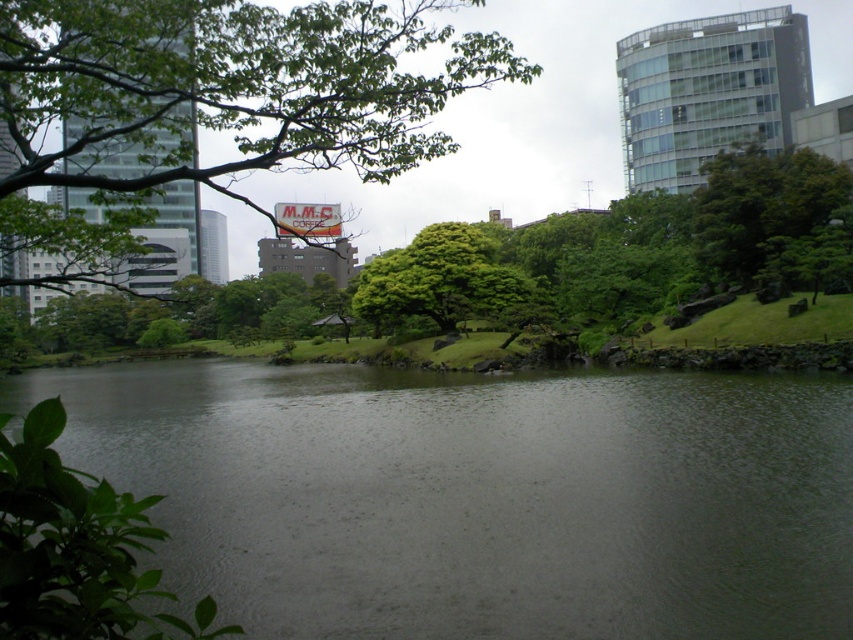
Question: Is green leafy tree at upper center below green leafy tree at center?

Choices:
 (A) no
 (B) yes

Answer: (A)

Question: Among these points, which one is nearest to the camera?

Choices:
 (A) (395, 260)
 (B) (488, 80)

Answer: (A)

Question: Which object appears closest to the camera in this image?

Choices:
 (A) green leafy tree at upper center
 (B) green leafy tree at center

Answer: (A)

Question: Can you confirm if green water at center is smaller than green leafy tree at upper center?

Choices:
 (A) yes
 (B) no

Answer: (A)

Question: Is green water at center to the right of green leafy tree at center from the viewer's perspective?

Choices:
 (A) no
 (B) yes

Answer: (A)

Question: Considering the real-world distances, which object is farthest from the green leafy tree at upper center?

Choices:
 (A) green leafy tree at center
 (B) green water at center

Answer: (B)